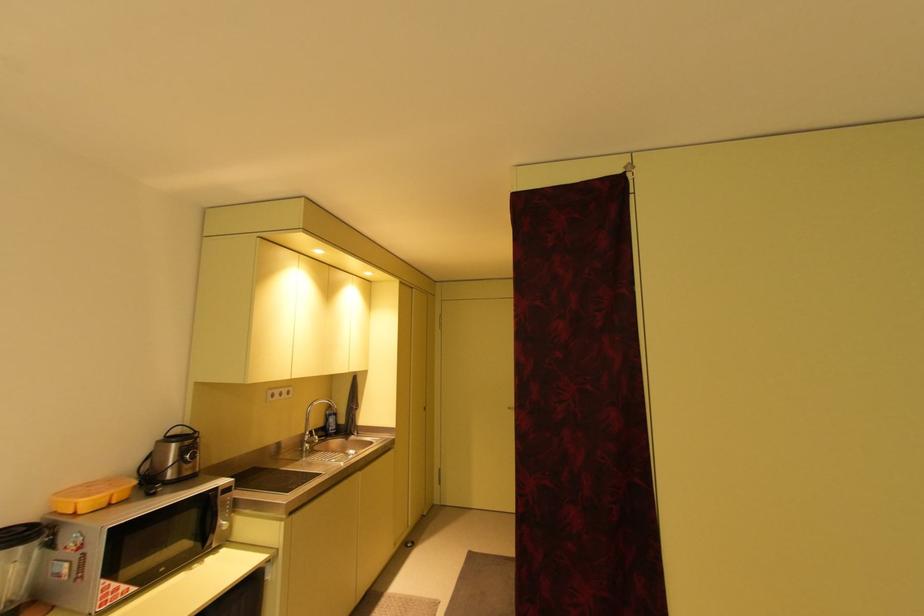
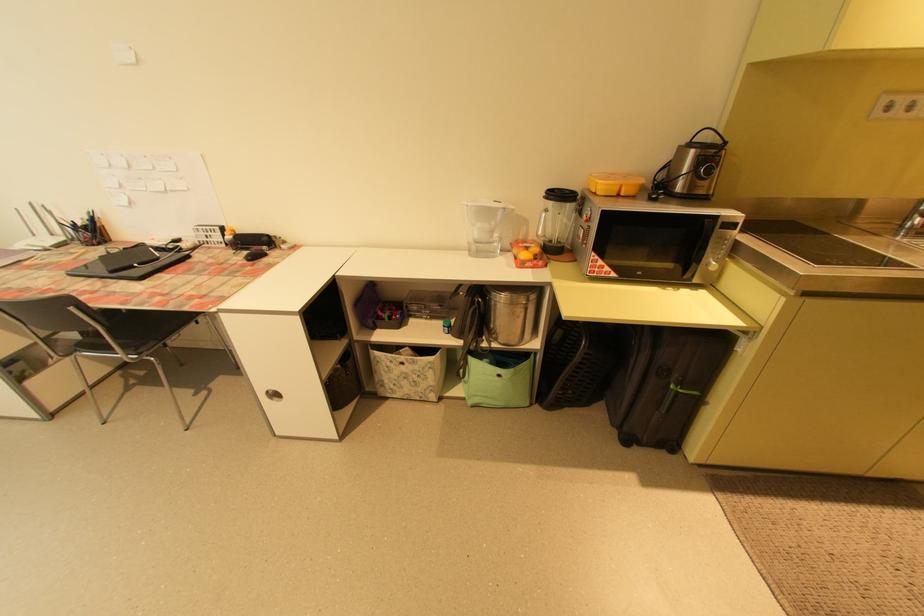
First-person continuous shooting, in which direction is the camera rotating?

The rotation direction of the camera is left-down.